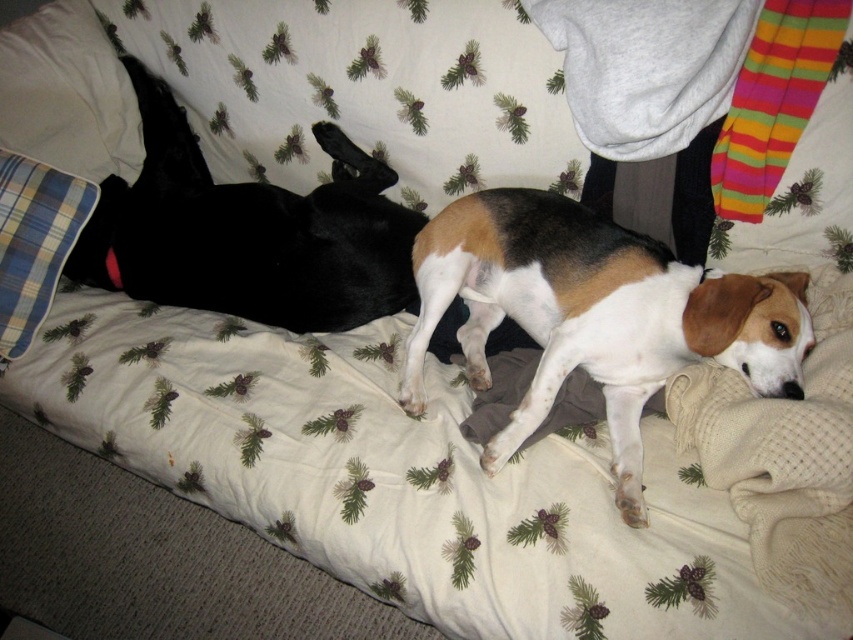
Question: Which point appears farthest from the camera in this image?

Choices:
 (A) tap(367, 177)
 (B) tap(9, 45)
 (C) tap(7, 353)

Answer: (B)

Question: Among these points, which one is farthest from the camera?

Choices:
 (A) (355, 259)
 (B) (659, 337)
 (C) (61, 141)
 (D) (35, 285)

Answer: (C)

Question: Is plaid fabric pillow at left wider than blue plaid pillow at left?

Choices:
 (A) no
 (B) yes

Answer: (B)

Question: Does black smooth dog at left have a greater width compared to plaid fabric pillow at left?

Choices:
 (A) yes
 (B) no

Answer: (A)

Question: Does tri-colored fur dog at center appear on the right side of plaid fabric pillow at left?

Choices:
 (A) no
 (B) yes

Answer: (B)

Question: Which object is farther from the camera taking this photo?

Choices:
 (A) plaid fabric pillow at left
 (B) tri-colored fur dog at center

Answer: (A)